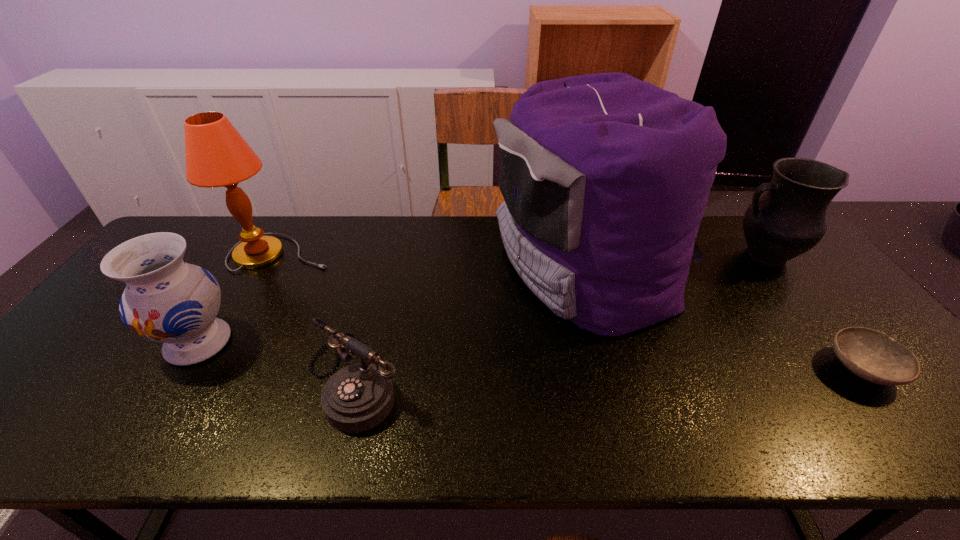
Locate an element on the screen. The image size is (960, 540). vacant space at the far right corner is located at coordinates (741, 239).

You are a GUI agent. You are given a task and a screenshot of the screen. Output one action in this format:
    pyautogui.click(x=<x>, y=<y>)
    Task: Click on the free point between the bowl and the second shortest object
    
    Given the screenshot: What is the action you would take?
    pyautogui.click(x=609, y=374)

Identify the location of empty location between the bowl and the pitcher. (813, 312).

Find the location of a particular element. vacant area between the lamp and the tallest object is located at coordinates (434, 261).

Identify the location of free space between the telephone and the lamp. coord(319,316).

Where is `free space between the vase and the shortest object`? Image resolution: width=960 pixels, height=540 pixels. free space between the vase and the shortest object is located at coordinates (530, 356).

At what (x,y) coordinates should I click in order to perform the action: click on vacant area that lies between the shortest object and the vase. Please return your answer as a coordinate pair (x, y). The width and height of the screenshot is (960, 540). Looking at the image, I should click on (530, 356).

Choose which object is the fifth nearest neighbor to the third object from right to left. Please provide its 2D coordinates. Your answer should be formatted as a tuple, i.e. [(x, y)], where the tuple contains the x and y coordinates of a point satisfying the conditions above.

[(167, 300)]

Locate an element on the screen. The width and height of the screenshot is (960, 540). the second closest object to the fourth object from left to right is located at coordinates (358, 397).

Where is `vacant area in the image that satisfies the following two spatial constraints: 1. on the front side of the vase; 2. on the right side of the shortest object`? The height and width of the screenshot is (540, 960). vacant area in the image that satisfies the following two spatial constraints: 1. on the front side of the vase; 2. on the right side of the shortest object is located at coordinates click(182, 369).